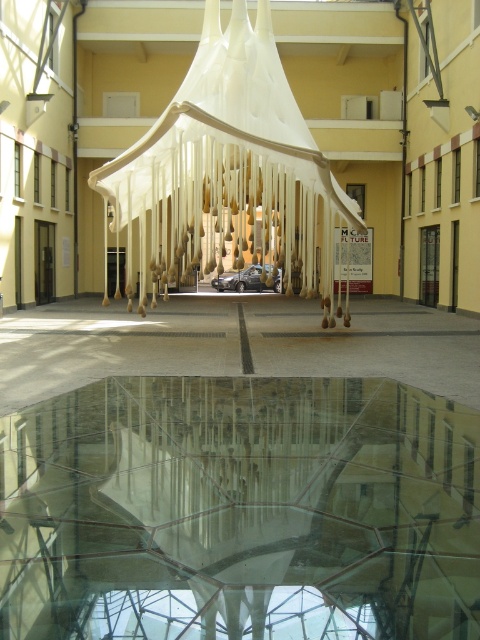
Question: Does transparent glass table at center have a lesser width compared to white fabric canopy bed at center?

Choices:
 (A) yes
 (B) no

Answer: (A)

Question: Is transparent glass table at center to the left of white fabric canopy bed at center from the viewer's perspective?

Choices:
 (A) no
 (B) yes

Answer: (A)

Question: Which of the following is the closest to the observer?

Choices:
 (A) (130, 163)
 (B) (50, 563)

Answer: (B)

Question: Which point is farther from the camera taking this photo?

Choices:
 (A) (310, 634)
 (B) (226, 147)

Answer: (B)

Question: Is transparent glass table at center below white fabric canopy bed at center?

Choices:
 (A) yes
 (B) no

Answer: (A)